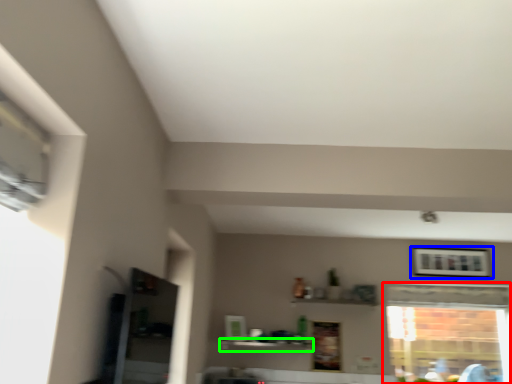
Question: Which object is the farthest from window (highlighted by a red box)? Choose among these: picture frame (highlighted by a blue box) or shelf (highlighted by a green box).

Choices:
 (A) picture frame
 (B) shelf

Answer: (B)